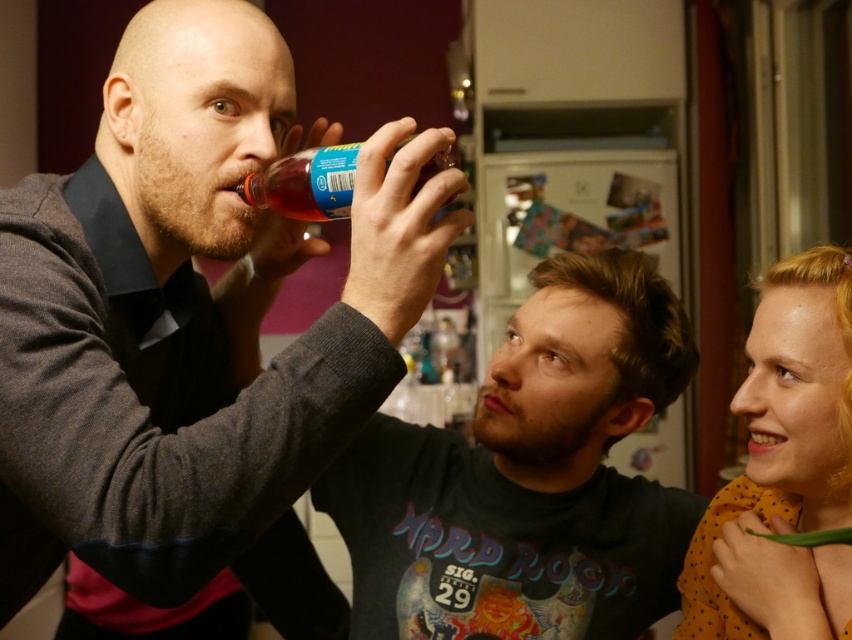
Does matte black bottle at upper left appear on the right side of translucent plastic bottle at upper center?

In fact, matte black bottle at upper left is to the left of translucent plastic bottle at upper center.

Consider the image. Does matte black bottle at upper left have a lesser width compared to translucent plastic bottle at upper center?

Incorrect, matte black bottle at upper left's width is not less than translucent plastic bottle at upper center's.

Does point (291, 113) come behind point (413, 196)?

Yes.

Where is `matte black bottle at upper left`? This screenshot has width=852, height=640. matte black bottle at upper left is located at coordinates (188, 314).

Does matte black bottle at upper left have a smaller size compared to polka dot fabric at right?

Actually, matte black bottle at upper left might be larger than polka dot fabric at right.

This screenshot has width=852, height=640. In order to click on matte black bottle at upper left in this screenshot , I will do `click(188, 314)`.

Which is behind, point (836, 476) or point (410, 140)?

The point (836, 476) is behind.

You are a GUI agent. You are given a task and a screenshot of the screen. Output one action in this format:
    pyautogui.click(x=<x>, y=<y>)
    Task: Click on the polka dot fabric at right
    The image size is (852, 640).
    Given the screenshot: What is the action you would take?
    pyautogui.click(x=783, y=468)